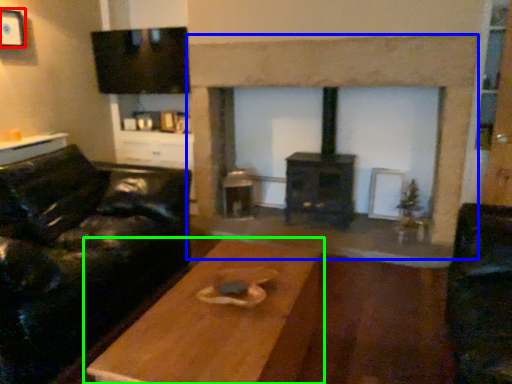
Question: Which object is the farthest from picture frame (highlighted by a red box)? Choose among these: fireplace (highlighted by a blue box) or table (highlighted by a green box).

Choices:
 (A) fireplace
 (B) table

Answer: (B)